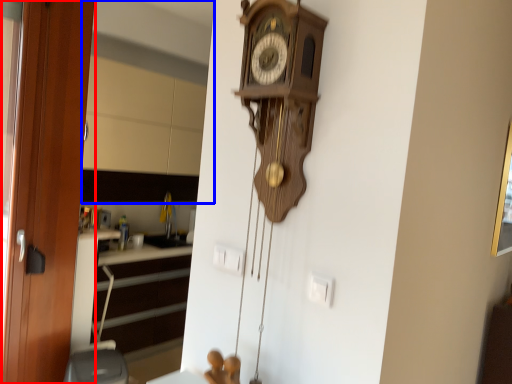
Question: Which object appears farthest to the camera in this image, door (highlighted by a red box) or mirror (highlighted by a blue box)?

Choices:
 (A) door
 (B) mirror

Answer: (B)